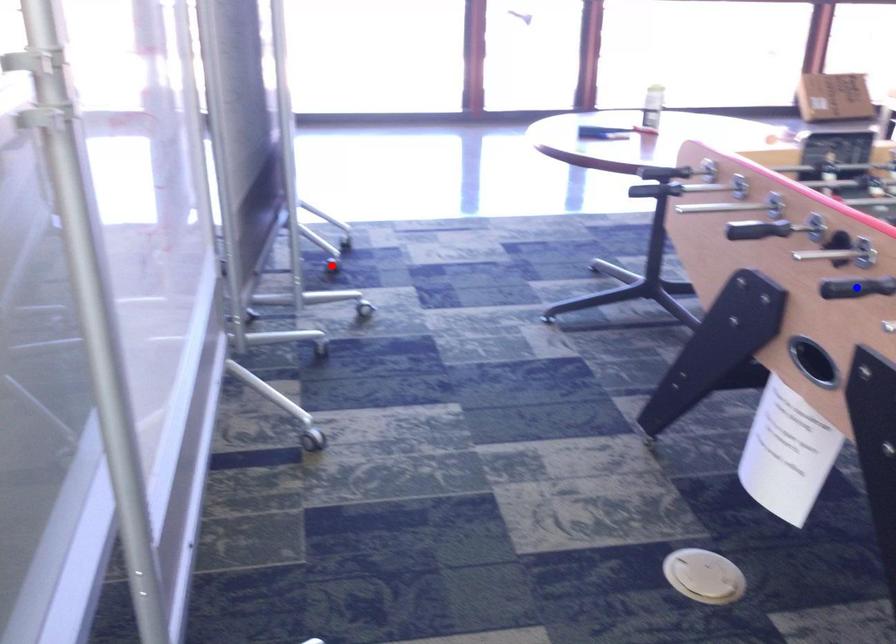
Question: Two points are marked on the image. Which point is closer to the camera?

Choices:
 (A) Blue point is closer.
 (B) Red point is closer.

Answer: (A)